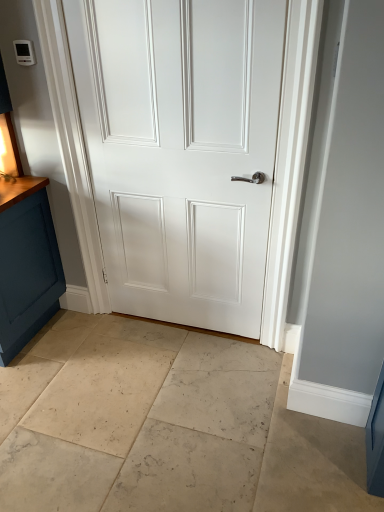
Where is `blank space situated above beige marble floor at center (from a real-world perspective)`? blank space situated above beige marble floor at center (from a real-world perspective) is located at coordinates (153, 415).